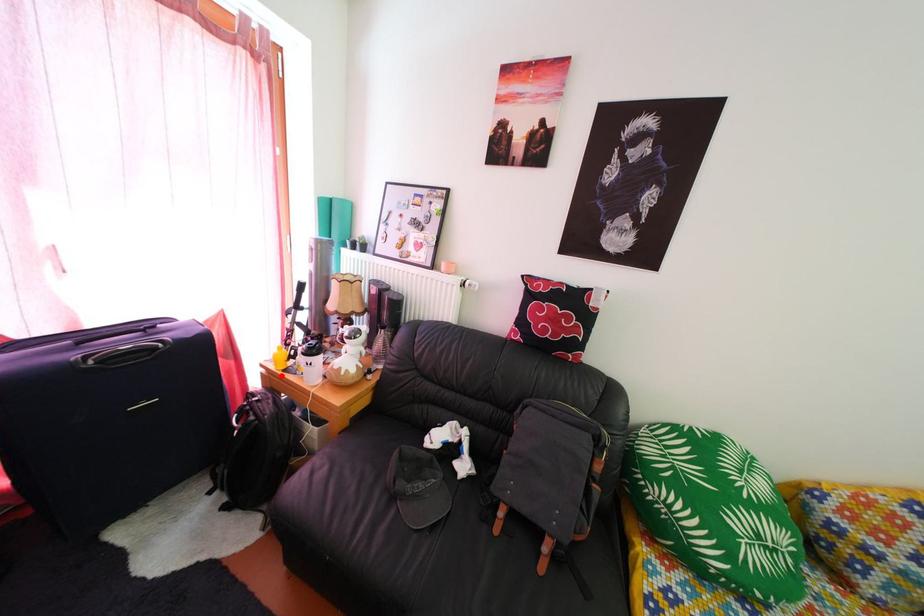
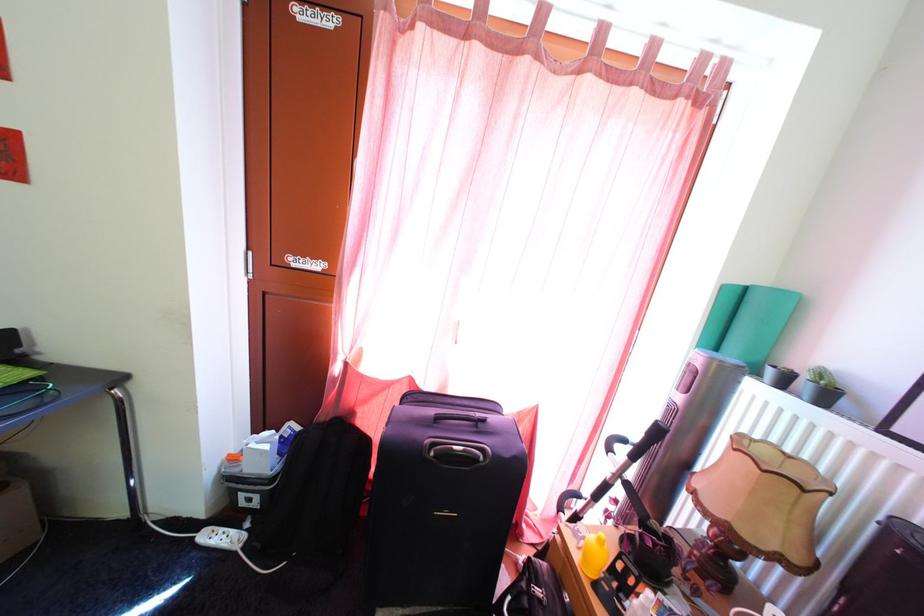
Question: A red point is marked in image1. In image2, is the corresponding 3D point closer to the camera or farther? Reply with the corresponding letter.

Choices:
 (A) The corresponding 3D point is closer.
 (B) The corresponding 3D point is farther.

Answer: (A)